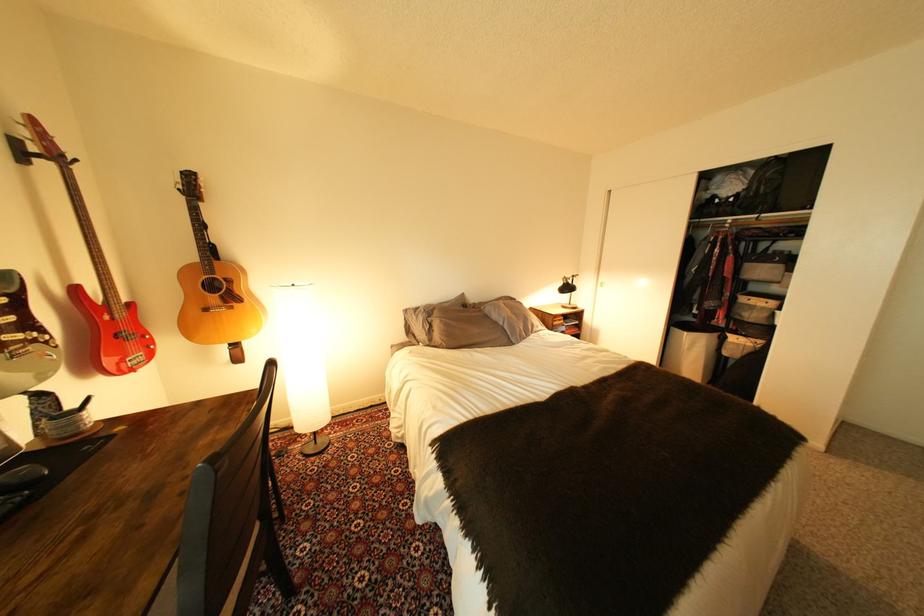
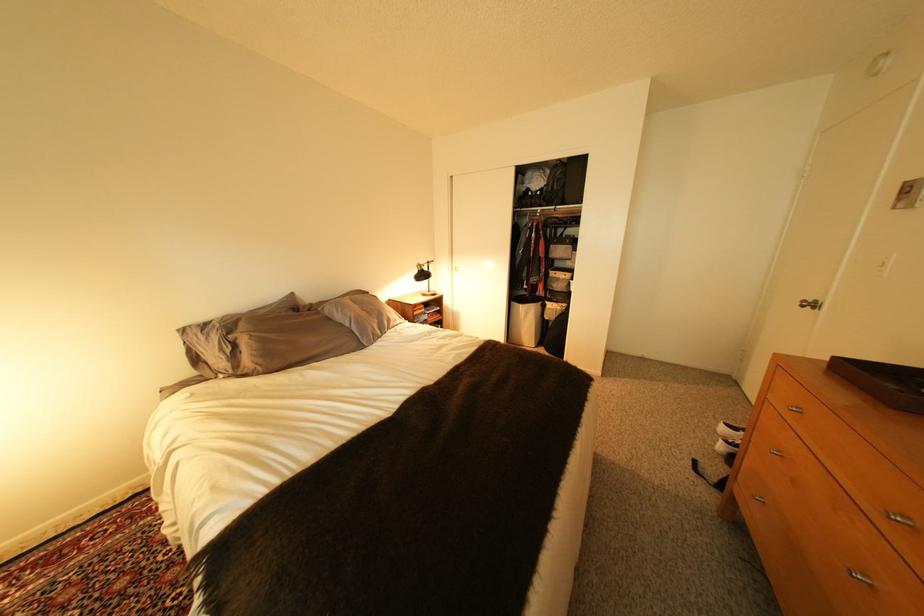
Question: The images are taken continuously from a first-person perspective. In which direction is your viewpoint rotating?

Choices:
 (A) Left
 (B) Right
 (C) Up
 (D) Down

Answer: (B)